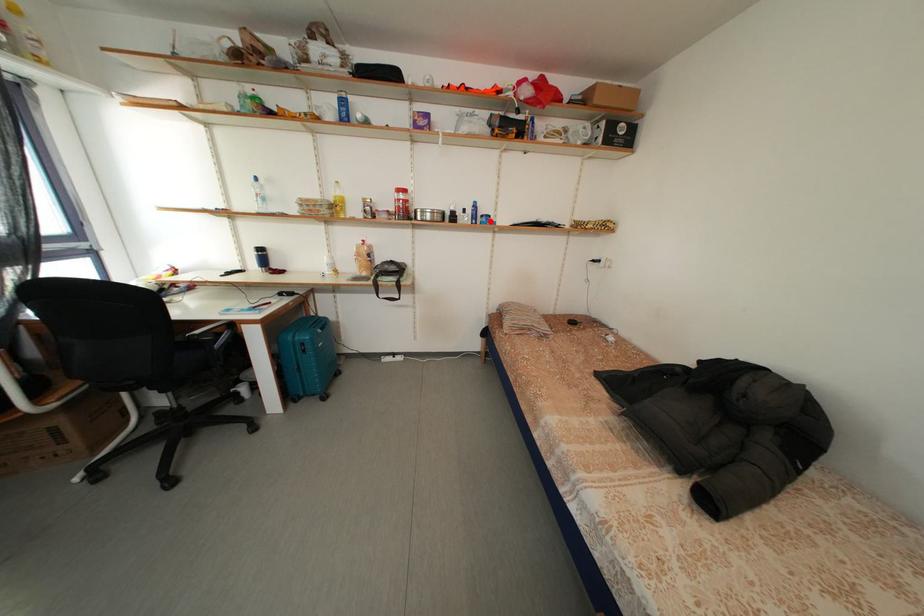
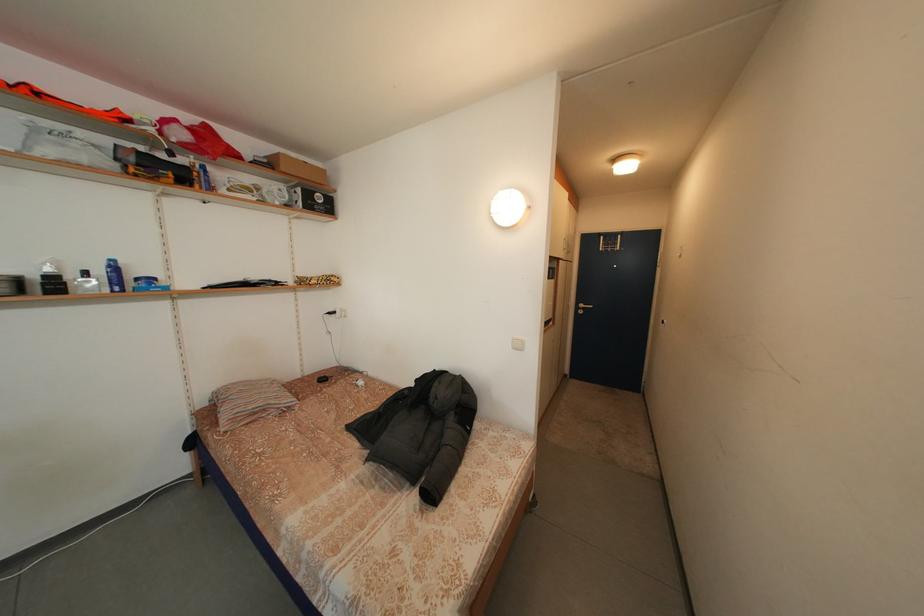
Question: I am providing you with two images of the same scene from different viewpoints. A red point is shown in image1. For the corresponding object point in image2, is it positioned nearer or farther from the camera?

Choices:
 (A) Nearer
 (B) Farther

Answer: (B)